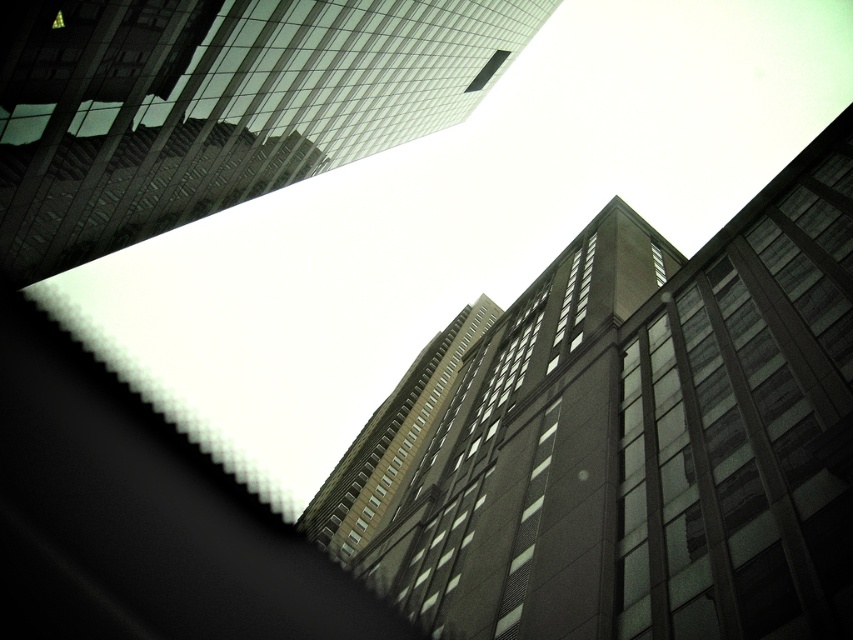
Describe the element at coordinates (651, 436) in the screenshot. This screenshot has height=640, width=853. I see `dark gray concrete building at center` at that location.

Can you confirm if dark gray concrete building at center is positioned above glassy reflective skyscraper at upper center?

No.

Does point (567, 499) lie behind point (4, 65)?

That is True.

Find the location of a particular element. dark gray concrete building at center is located at coordinates coord(651,436).

From the picture: Which is above, glassy reflective skyscraper at upper center or brown glass building at center?

glassy reflective skyscraper at upper center

Consider the image. Who is more distant from viewer, (252, 156) or (325, 512)?

The point (325, 512) is behind.

Does point (421, 72) come farther from viewer compared to point (352, 544)?

No, (421, 72) is closer to viewer.

You are a GUI agent. You are given a task and a screenshot of the screen. Output one action in this format:
    pyautogui.click(x=<x>, y=<y>)
    Task: Click on the glassy reflective skyscraper at upper center
    
    Given the screenshot: What is the action you would take?
    pyautogui.click(x=218, y=104)

You are a GUI agent. You are given a task and a screenshot of the screen. Output one action in this format:
    pyautogui.click(x=<x>, y=<y>)
    Task: Click on the dark gray concrete building at center
    Image resolution: width=853 pixels, height=640 pixels.
    Given the screenshot: What is the action you would take?
    pyautogui.click(x=651, y=436)

Can you confirm if dark gray concrete building at center is wider than brown glass building at center?

No, dark gray concrete building at center is not wider than brown glass building at center.

At what (x,y) coordinates should I click in order to perform the action: click on dark gray concrete building at center. Please return your answer as a coordinate pair (x, y). The width and height of the screenshot is (853, 640). Looking at the image, I should click on (651, 436).